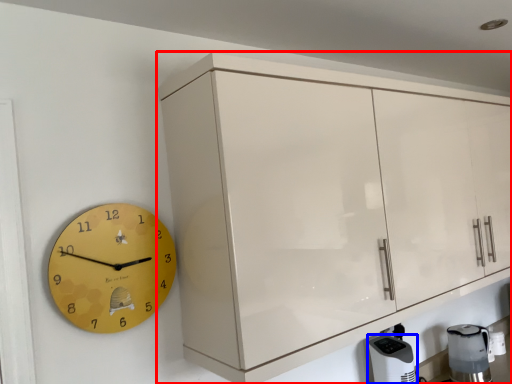
Question: Among these objects, which one is nearest to the camera, cabinetry (highlighted by a red box) or appliance (highlighted by a blue box)?

Choices:
 (A) cabinetry
 (B) appliance

Answer: (A)